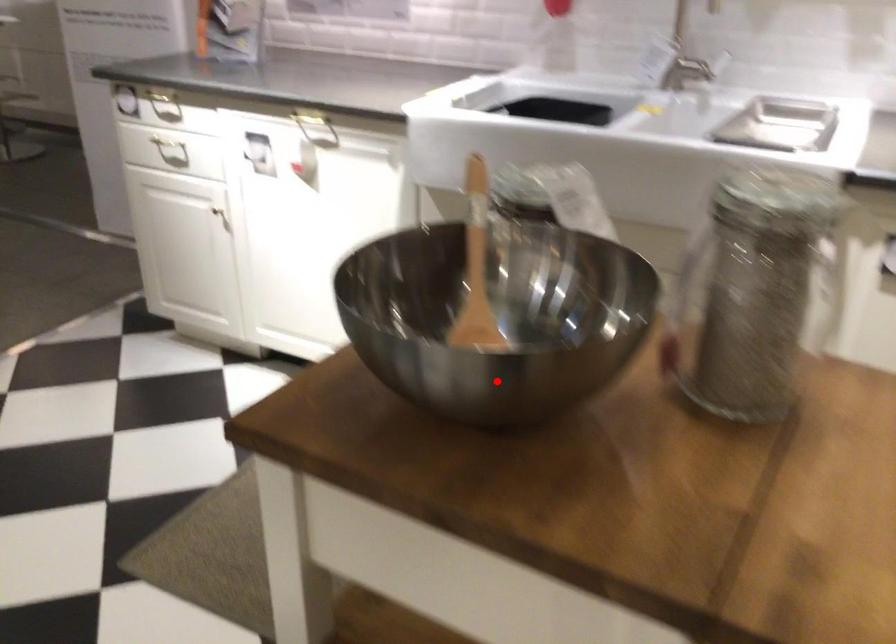
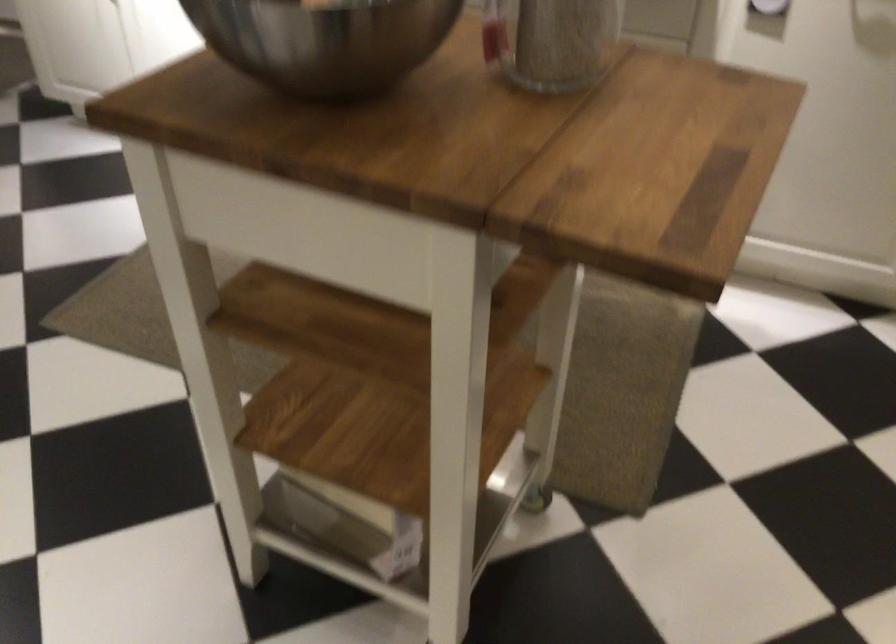
Question: I am providing you with two images of the same scene from different viewpoints. Image1 has a red point marked. In image2, the corresponding 3D location appears at what relative position? Reply with the corresponding letter.

Choices:
 (A) Closer
 (B) Farther

Answer: (B)